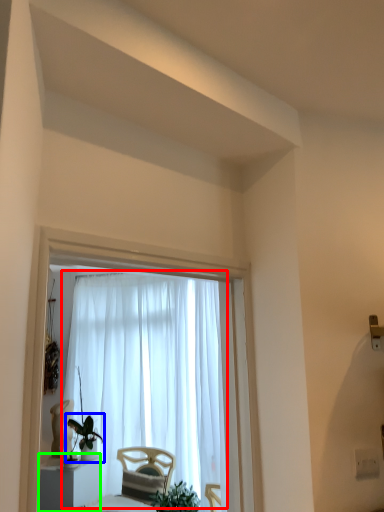
Question: Which is nearer to the curtain (highlighted by a red box)? houseplant (highlighted by a blue box) or furniture (highlighted by a green box).

Choices:
 (A) houseplant
 (B) furniture

Answer: (A)